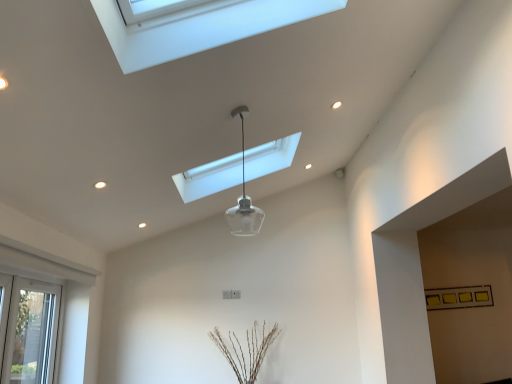
Question: From a real-world perspective, relative to white plastic window at lower left, is transparent glass pendant light at center, the first lamp positioned from the front, vertically above or below?

Choices:
 (A) above
 (B) below

Answer: (A)

Question: In the image, is transparent glass pendant light at center, the 2th lamp viewed from the back, on the left side or the right side of white plastic window at lower left?

Choices:
 (A) right
 (B) left

Answer: (A)

Question: Which object is the farthest from the transparent glass pendant light at center, the first lamp positioned from the front?

Choices:
 (A) white plastic window at lower left
 (B) transparent glass pendant light at center, acting as the 2th lamp starting from the front

Answer: (A)

Question: Which object is the farthest from the transparent glass pendant light at center, the 2th lamp viewed from the back?

Choices:
 (A) transparent glass pendant light at center, acting as the 2th lamp starting from the front
 (B) white plastic window at lower left

Answer: (B)